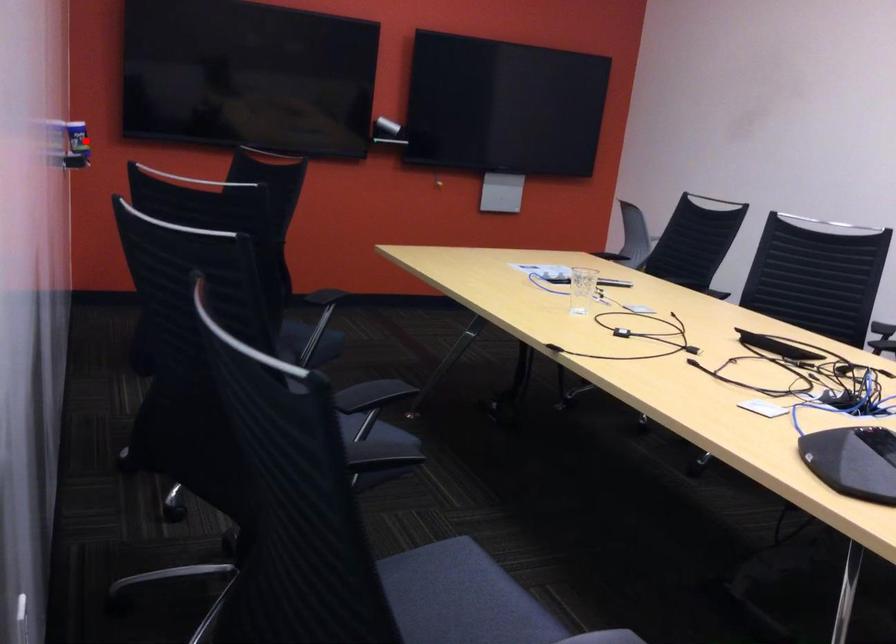
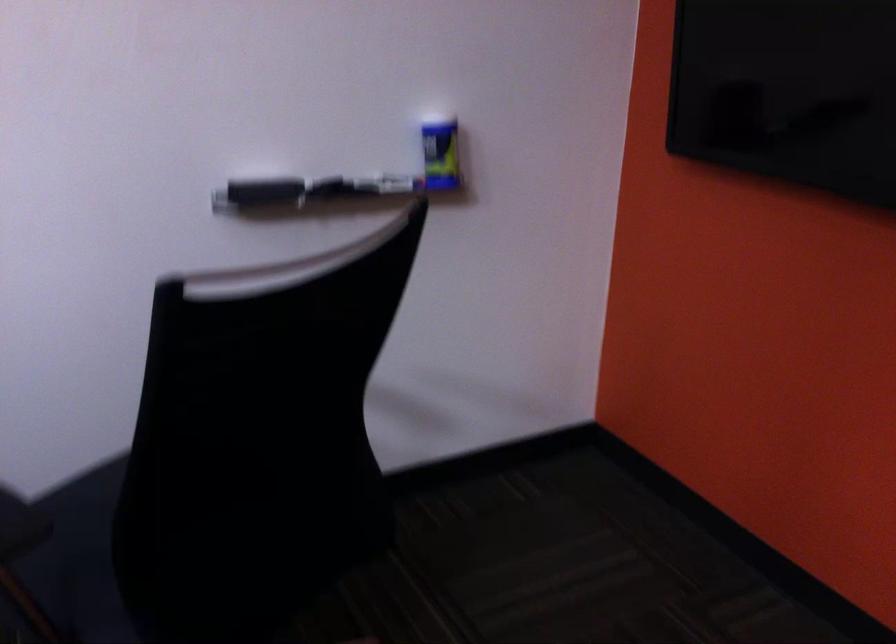
Question: A red point is marked in image1. In image2, is the corresponding 3D point closer to the camera or farther? Reply with the corresponding letter.

Choices:
 (A) The corresponding 3D point is closer.
 (B) The corresponding 3D point is farther.

Answer: (A)